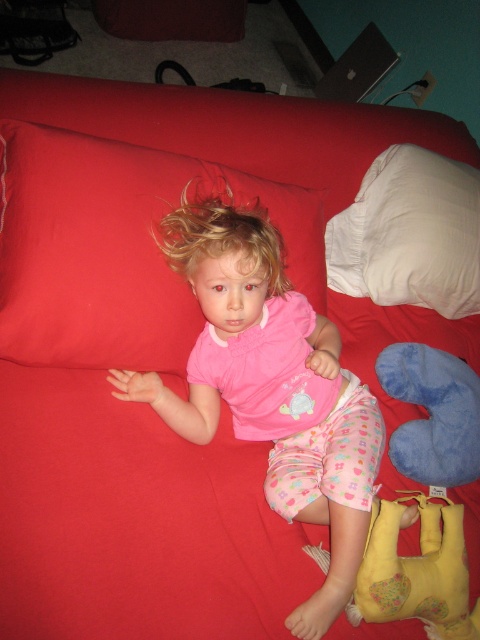
Question: Which point appears closest to the camera in this image?

Choices:
 (A) (248, 218)
 (B) (444, 588)

Answer: (B)

Question: Can you confirm if blue soft pillow at lower right is bigger than blonde curly hair at center?

Choices:
 (A) yes
 (B) no

Answer: (B)

Question: Can you confirm if white soft pillow at upper right is wider than blue soft pillow at lower right?

Choices:
 (A) no
 (B) yes

Answer: (B)

Question: Which point is closer to the camera taking this photo?

Choices:
 (A) (457, 224)
 (B) (430, 522)

Answer: (B)

Question: Which point is farther to the camera?

Choices:
 (A) pink fabric child at center
 (B) yellow fabric stuffed animal at lower right
 (C) white soft pillow at upper right

Answer: (C)

Question: Can you confirm if matte red pillow at upper left is positioned below white soft pillow at upper right?

Choices:
 (A) yes
 (B) no

Answer: (A)